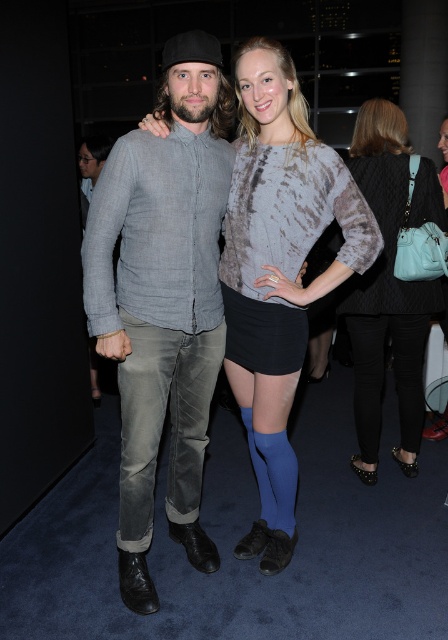
Is denim shirt at center wider than quilted black vest at center?

In fact, denim shirt at center might be narrower than quilted black vest at center.

Is point (113, 218) more distant than point (379, 396)?

No, (113, 218) is closer to viewer.

Is point (160, 273) closer to viewer compared to point (360, 422)?

Yes, point (160, 273) is closer to viewer.

At what (x,y) coordinates should I click in order to perform the action: click on denim shirt at center. Please return your answer as a coordinate pair (x, y). The width and height of the screenshot is (448, 640). Looking at the image, I should click on (163, 300).

Is black leather pants at lower right further to the viewer compared to denim jeans at center?

That is False.

Does black leather pants at lower right lie in front of denim jeans at center?

Yes.

What do you see at coordinates (383, 376) in the screenshot? The width and height of the screenshot is (448, 640). I see `black leather pants at lower right` at bounding box center [383, 376].

Find the location of a particular element. The image size is (448, 640). black leather pants at lower right is located at coordinates (383, 376).

Is washed denim jeans at center bigger than black leather pants at lower right?

Correct, washed denim jeans at center is larger in size than black leather pants at lower right.

Can you confirm if washed denim jeans at center is positioned to the left of black leather pants at lower right?

Indeed, washed denim jeans at center is positioned on the left side of black leather pants at lower right.

The width and height of the screenshot is (448, 640). In order to click on washed denim jeans at center in this screenshot , I will do `click(163, 422)`.